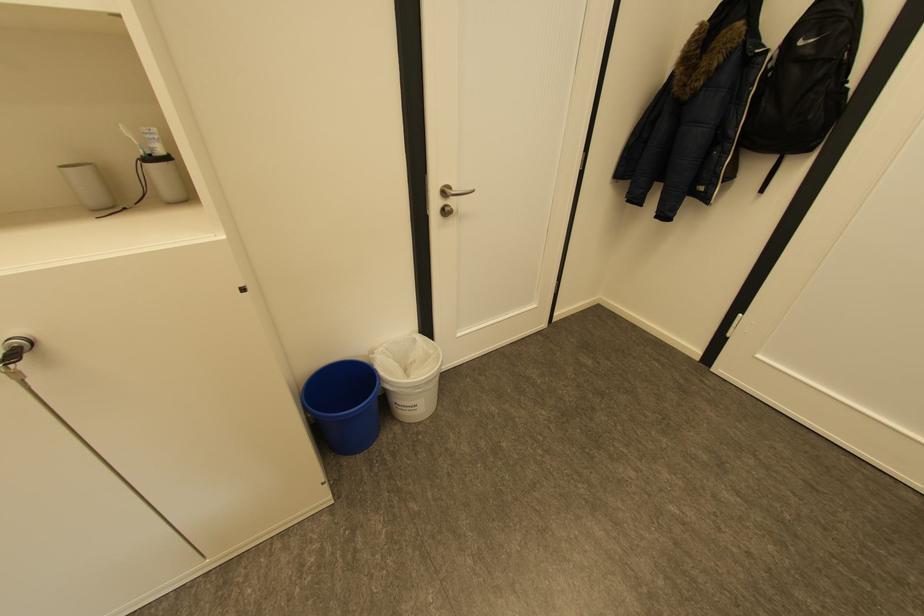
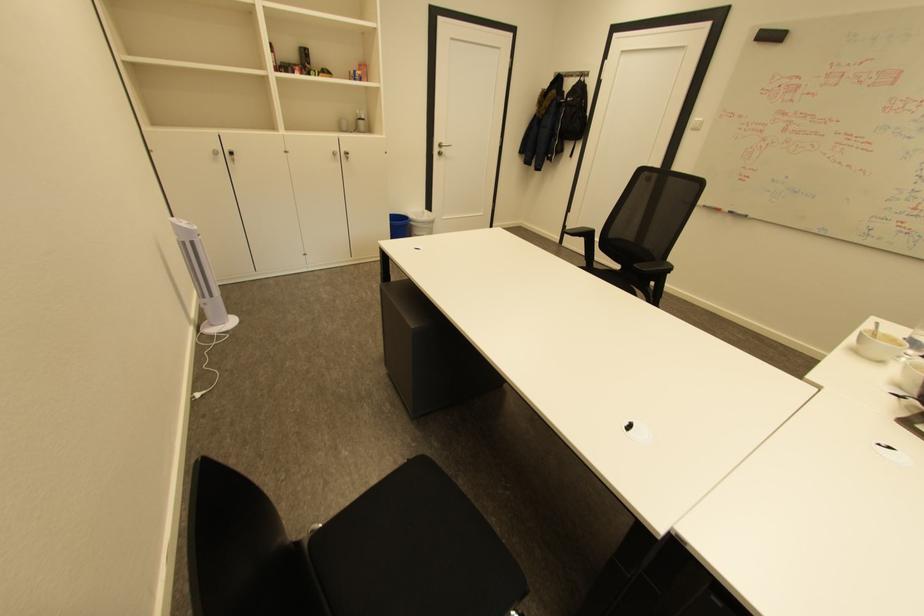
Where in the second image is the point corresponding to pixel 451 192 from the first image?

(446, 146)